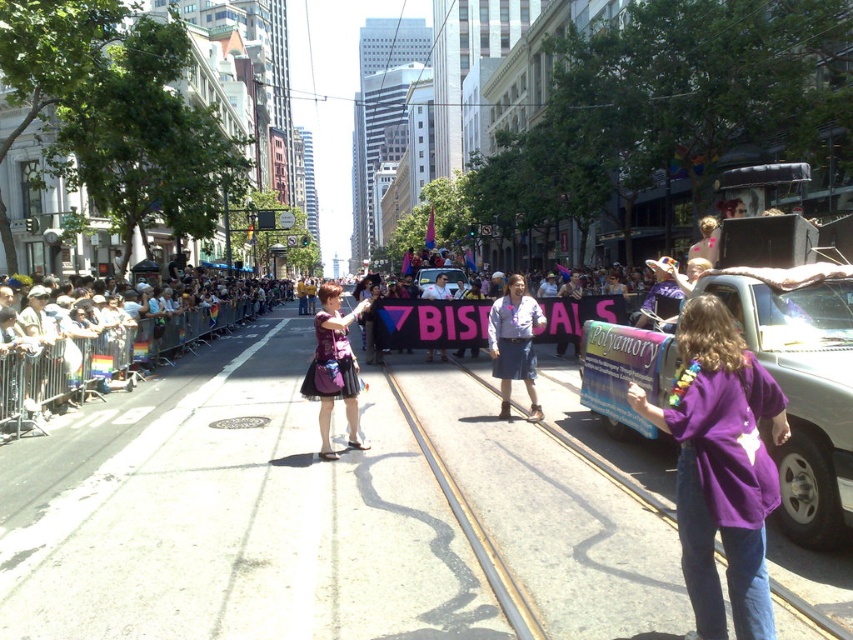
Question: Which object is the farthest from the purple fabric skirt at center?

Choices:
 (A) white plastic barrier at left
 (B) denim skirt at center
 (C) purple fabric dress at center
 (D) purple cotton shirt at center

Answer: (D)

Question: Can you confirm if purple fabric dress at center is positioned to the left of purple fabric skirt at center?

Choices:
 (A) no
 (B) yes

Answer: (B)

Question: Is denim skirt at center below purple fabric skirt at center?

Choices:
 (A) no
 (B) yes

Answer: (A)

Question: Which point appears farthest from the camera in this image?

Choices:
 (A) (444, 276)
 (B) (695, 403)

Answer: (A)

Question: Which object is positioned closest to the purple fabric skirt at center?

Choices:
 (A) purple fabric dress at center
 (B) denim skirt at center

Answer: (B)

Question: Is purple cotton shirt at center closer to camera compared to denim skirt at center?

Choices:
 (A) no
 (B) yes

Answer: (B)